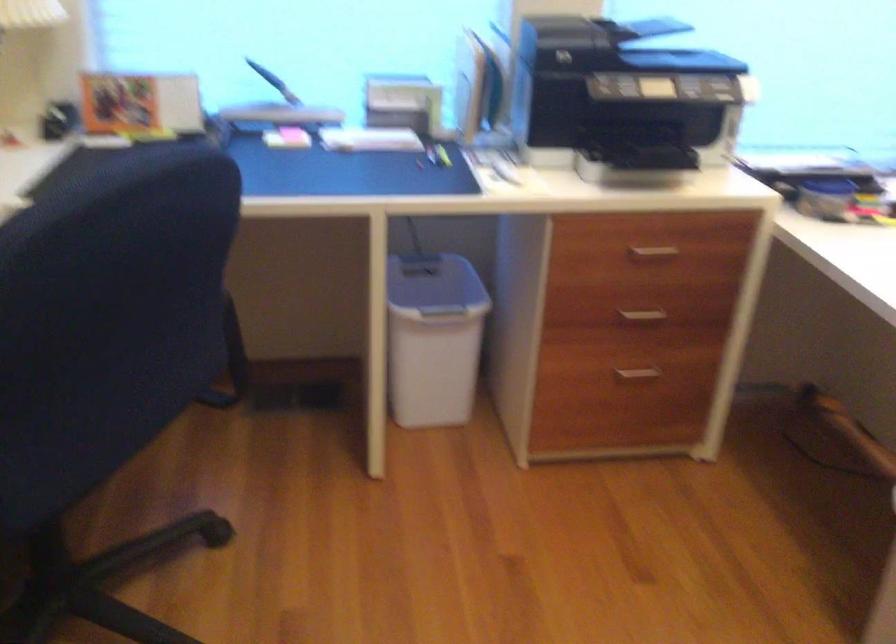
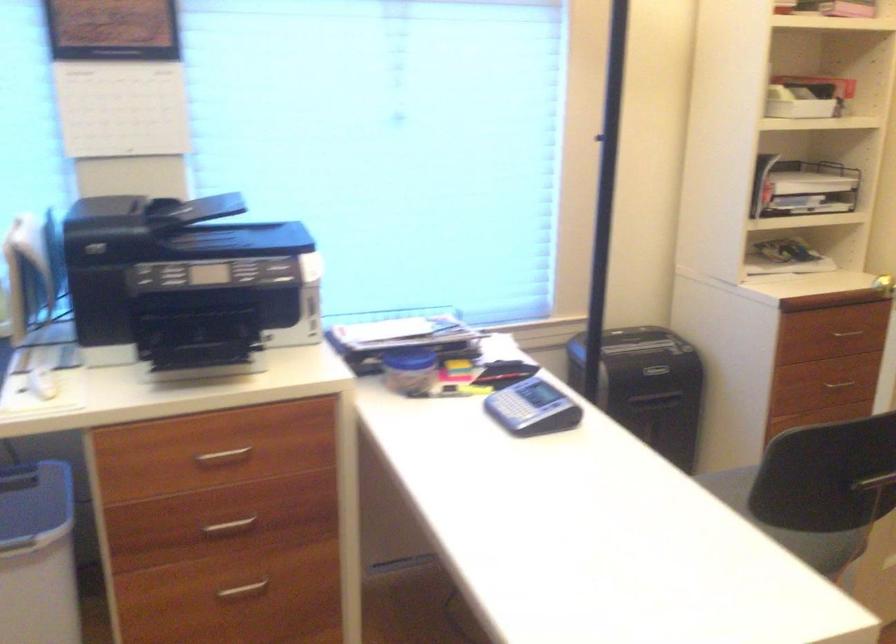
Question: Which direction would the cameraman need to move to produce the second image? Reply with the corresponding letter.

Choices:
 (A) Left
 (B) Right
 (C) Forward
 (D) Backward

Answer: (B)